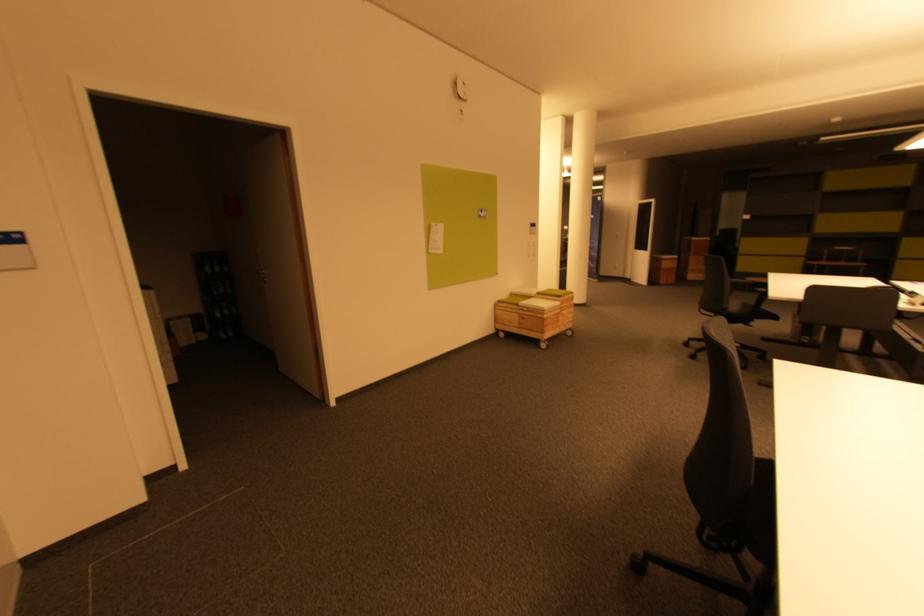
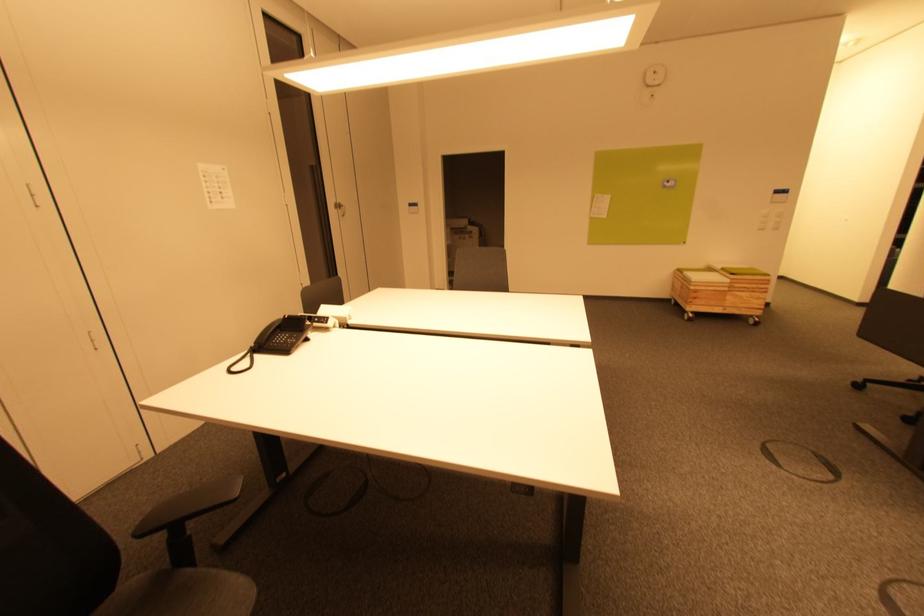
In the second image, find the point that corresponds to point (573, 315) in the first image.

(756, 300)